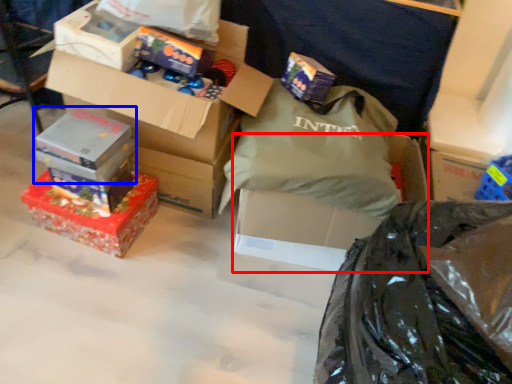
Question: Which of the following is the closest to the observer, box (highlighted by a red box) or box (highlighted by a blue box)?

Choices:
 (A) box
 (B) box

Answer: (A)